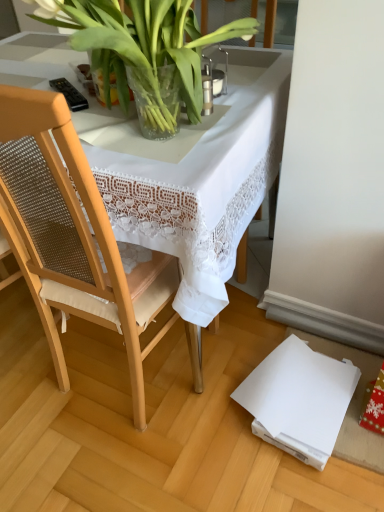
What is the approximate height of clear glass vase at upper center?

30.95 centimeters.

Describe the element at coordinates (72, 234) in the screenshot. I see `wooden chair at left` at that location.

Find the location of `clear glass vase at upper center`. clear glass vase at upper center is located at coordinates (141, 45).

Can you tell me how much white lace tablecloth at center and wooden chair at left differ in facing direction?

The angular difference between white lace tablecloth at center and wooden chair at left is 92.5 degrees.

From a real-world perspective, which is physically above, white lace tablecloth at center or wooden chair at left?

From a 3D spatial view, wooden chair at left is above.

Considering the positions of points (121, 189) and (24, 219), is point (121, 189) farther from camera compared to point (24, 219)?

No, (121, 189) is closer to viewer.

Can you confirm if wooden chair at left is thinner than white lace tablecloth at center?

Correct, the width of wooden chair at left is less than that of white lace tablecloth at center.

Which object is closer to the camera taking this photo, wooden chair at left or white lace tablecloth at center?

wooden chair at left is in front.

Which object is positioned more to the right, wooden chair at left or white lace tablecloth at center?

wooden chair at left.

Is white lace tablecloth at center placed right next to clear glass vase at upper center?

white lace tablecloth at center and clear glass vase at upper center are not in contact.

Consider the image. Is white lace tablecloth at center oriented away from clear glass vase at upper center?

white lace tablecloth at center does not have its back to clear glass vase at upper center.

Is white lace tablecloth at center positioned in front of clear glass vase at upper center?

No.

How different are the orientations of clear glass vase at upper center and wooden chair at left in degrees?

They differ by 92.2 degrees in their facing directions.

Can you confirm if clear glass vase at upper center is wider than wooden chair at left?

In fact, clear glass vase at upper center might be narrower than wooden chair at left.

Is clear glass vase at upper center further to the viewer compared to wooden chair at left?

Yes, it is.

Is clear glass vase at upper center looking in the opposite direction of wooden chair at left?

Yes.

In the scene shown: How many degrees apart are the facing directions of clear glass vase at upper center and white lace tablecloth at center?

0.274 degrees separate the facing orientations of clear glass vase at upper center and white lace tablecloth at center.

Is clear glass vase at upper center at the right side of white lace tablecloth at center?

Correct, you'll find clear glass vase at upper center to the right of white lace tablecloth at center.

Between clear glass vase at upper center and white lace tablecloth at center, which one has smaller size?

clear glass vase at upper center is smaller.

Can you see clear glass vase at upper center touching white lace tablecloth at center?

No, clear glass vase at upper center is not with white lace tablecloth at center.

Can you confirm if wooden chair at left is positioned to the right of clear glass vase at upper center?

In fact, wooden chair at left is to the left of clear glass vase at upper center.

Is there a large distance between wooden chair at left and clear glass vase at upper center?

They are positioned close to each other.

Which of these two, wooden chair at left or clear glass vase at upper center, is wider?

With larger width is wooden chair at left.

Where is `table below the wooden chair at left (from a real-world perspective)`? The width and height of the screenshot is (384, 512). table below the wooden chair at left (from a real-world perspective) is located at coordinates (196, 178).

Where is `table behind the wooden chair at left`? The height and width of the screenshot is (512, 384). table behind the wooden chair at left is located at coordinates (196, 178).

From the picture: Looking at the image, which one is located further to wooden chair at left, white lace tablecloth at center or clear glass vase at upper center?

clear glass vase at upper center is positioned further to the anchor wooden chair at left.

Considering their positions, is wooden chair at left positioned further to white lace tablecloth at center than clear glass vase at upper center?

wooden chair at left is positioned further to the anchor white lace tablecloth at center.

Estimate the real-world distances between objects in this image. Which object is further from wooden chair at left, clear glass vase at upper center or white lace tablecloth at center?

The object further to wooden chair at left is clear glass vase at upper center.

When comparing their distances from clear glass vase at upper center, does white lace tablecloth at center or wooden chair at left seem further?

wooden chair at left lies further to clear glass vase at upper center than the other object.

Looking at the image, which one is located further to clear glass vase at upper center, wooden chair at left or white lace tablecloth at center?

wooden chair at left is positioned further to the anchor clear glass vase at upper center.

From the image, which object appears to be nearer to white lace tablecloth at center, clear glass vase at upper center or wooden chair at left?

clear glass vase at upper center.

What are the coordinates of `table between clear glass vase at upper center and wooden chair at left in the up-down direction` in the screenshot? It's located at (196, 178).